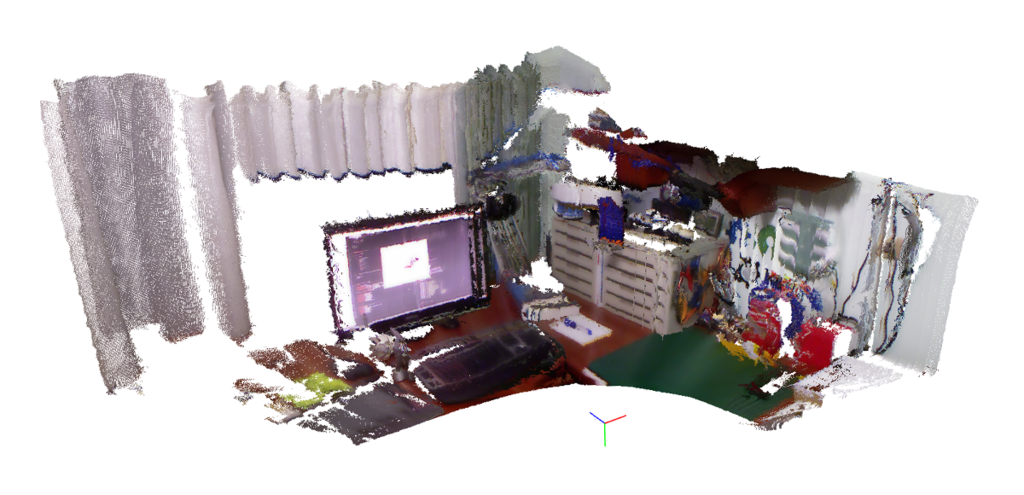
Where is `empty white space behind the desktop monitor`? empty white space behind the desktop monitor is located at coordinates (279, 301), (285, 214), (395, 196).